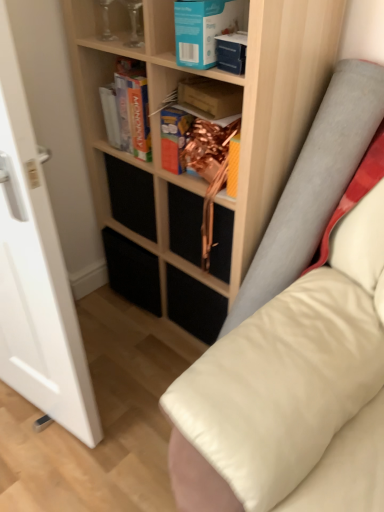
Identify the location of free location in front of transparent glass door at left. The width and height of the screenshot is (384, 512). (38, 461).